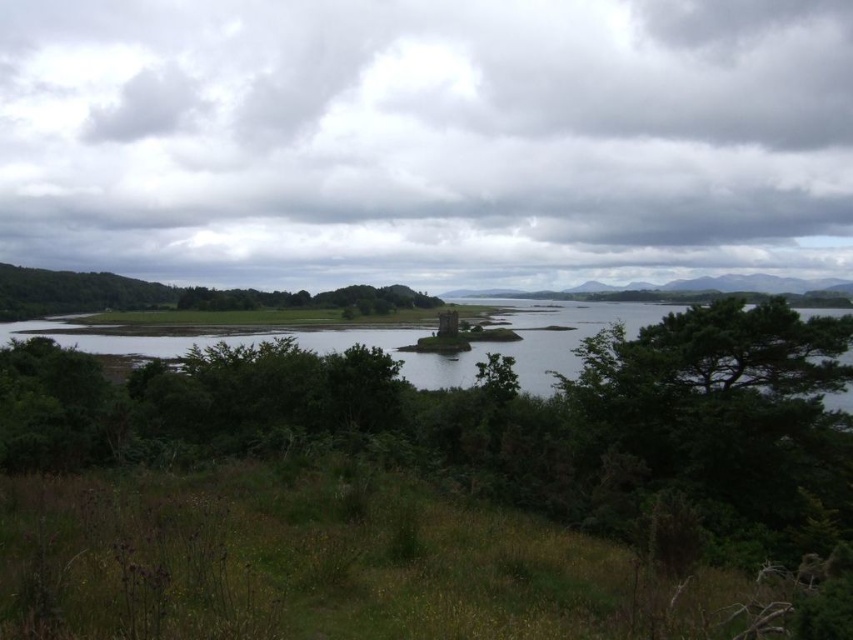
You are a pilot flying a small plane and need to land at the airport located on the grassy island with the tower. The control tower instructs you to adjust your altitude so that the cloudy sky at upper center is directly above your plane. What coordinate should you aim for?

You should aim for the coordinate point at 0.219 on the x axis and 0.501 on the y axis to ensure the cloudy sky at upper center is directly above your plane.

You are standing on the green grassy water at lower center and want to look up to see the cloudy sky at upper center. Can you see it directly above you?

Yes, the cloudy sky at upper center is directly above the green grassy water at lower center, so you can see it above you.